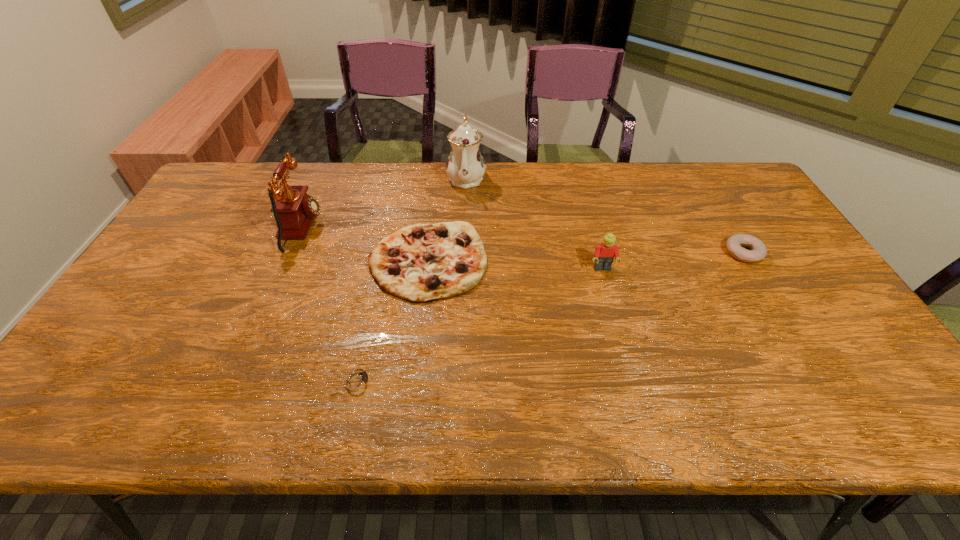
I want to click on chinaware, so click(x=465, y=166).

Find the location of a particular element. Image resolution: width=960 pixels, height=540 pixels. the leftmost object is located at coordinates (294, 210).

You are a GUI agent. You are given a task and a screenshot of the screen. Output one action in this format:
    pyautogui.click(x=<x>, y=<y>)
    Task: Click on the second object from right to left
    Image resolution: width=960 pixels, height=540 pixels.
    Given the screenshot: What is the action you would take?
    pyautogui.click(x=604, y=255)

Locate an element on the screen. the third tallest object is located at coordinates (604, 255).

This screenshot has width=960, height=540. In order to click on pizza in this screenshot , I will do `click(421, 263)`.

Image resolution: width=960 pixels, height=540 pixels. In order to click on doughnut in this screenshot , I will do `click(758, 251)`.

I want to click on the shortest object, so click(357, 380).

Locate an element on the screen. This screenshot has width=960, height=540. the nearest object is located at coordinates (357, 380).

Where is `free spot located 0.110m on the right of the farthest object`? The height and width of the screenshot is (540, 960). free spot located 0.110m on the right of the farthest object is located at coordinates (517, 178).

Identify the location of free region located on the dial of the telephone. (351, 229).